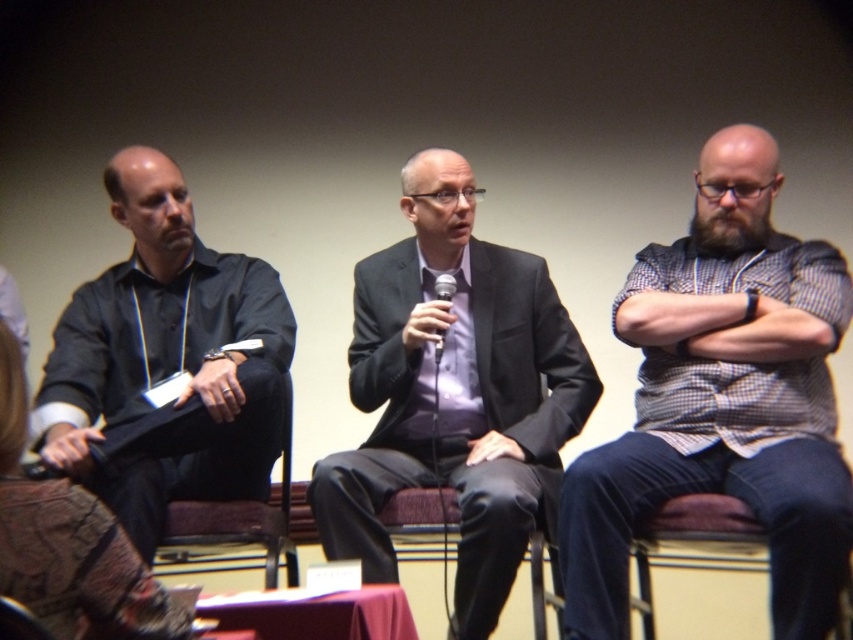
Can you confirm if checkered shirt at right is wider than black matte shirt at left?

Yes.

What do you see at coordinates (723, 401) in the screenshot? I see `checkered shirt at right` at bounding box center [723, 401].

Locate an element on the screen. This screenshot has height=640, width=853. checkered shirt at right is located at coordinates (723, 401).

Who is more distant from viewer, (131, 323) or (233, 524)?

The point (131, 323) is more distant.

Is point (88, 465) positioned before point (287, 477)?

Yes, it is.

The height and width of the screenshot is (640, 853). In order to click on black matte shirt at left in this screenshot , I will do `click(164, 355)`.

Does black matte shirt at left appear on the right side of black plastic microphone at center?

In fact, black matte shirt at left is to the left of black plastic microphone at center.

Is black matte shirt at left positioned before black plastic microphone at center?

Yes, black matte shirt at left is closer to the viewer.

The height and width of the screenshot is (640, 853). What do you see at coordinates (164, 355) in the screenshot?
I see `black matte shirt at left` at bounding box center [164, 355].

Locate an element on the screen. black matte shirt at left is located at coordinates (164, 355).